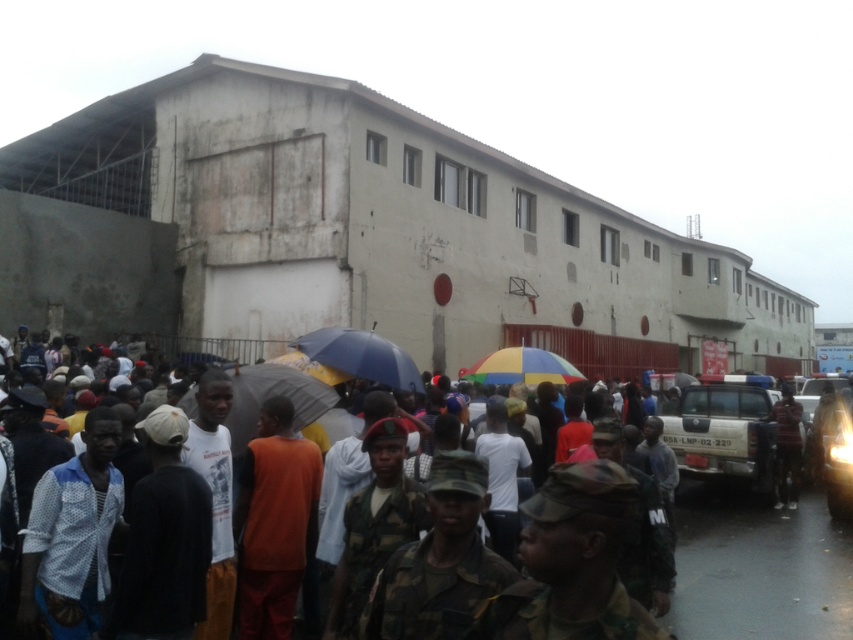
Measure the distance between point (289, 497) and camera.

The distance of point (289, 497) from camera is 6.64 meters.

Does orange fabric shirt at center appear on the right side of blue matte umbrella at center?

In fact, orange fabric shirt at center is to the left of blue matte umbrella at center.

Does point (267, 620) lie behind point (334, 340)?

No.

Where is `orange fabric shirt at center`? This screenshot has height=640, width=853. orange fabric shirt at center is located at coordinates (274, 522).

Who is shorter, white dotted shirt at center or orange fabric shirt at center?

white dotted shirt at center is shorter.

Who is more distant from viewer, (x=82, y=596) or (x=241, y=621)?

Positioned behind is point (x=241, y=621).

Does point (49, 621) lie in front of point (276, 460)?

Yes, point (49, 621) is closer to viewer.

The width and height of the screenshot is (853, 640). I want to click on white dotted shirt at center, so click(x=73, y=536).

Can you confirm if camouflage uniform at center is positioned above rainbow fabric umbrella at center?

Actually, camouflage uniform at center is below rainbow fabric umbrella at center.

Where is `camouflage uniform at center`? This screenshot has width=853, height=640. camouflage uniform at center is located at coordinates (160, 544).